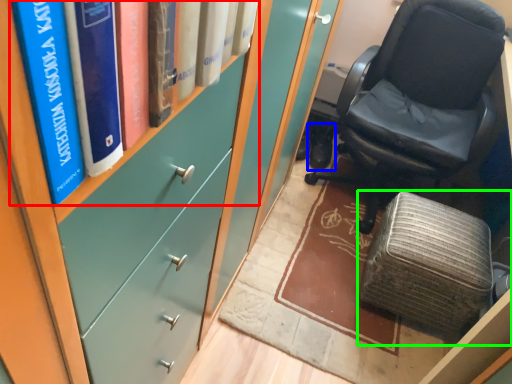
Question: Based on their relative distances, which object is farther from book (highlighted by a red box)? Choose from footwear (highlighted by a blue box) and furniture (highlighted by a green box).

Choices:
 (A) footwear
 (B) furniture

Answer: (A)